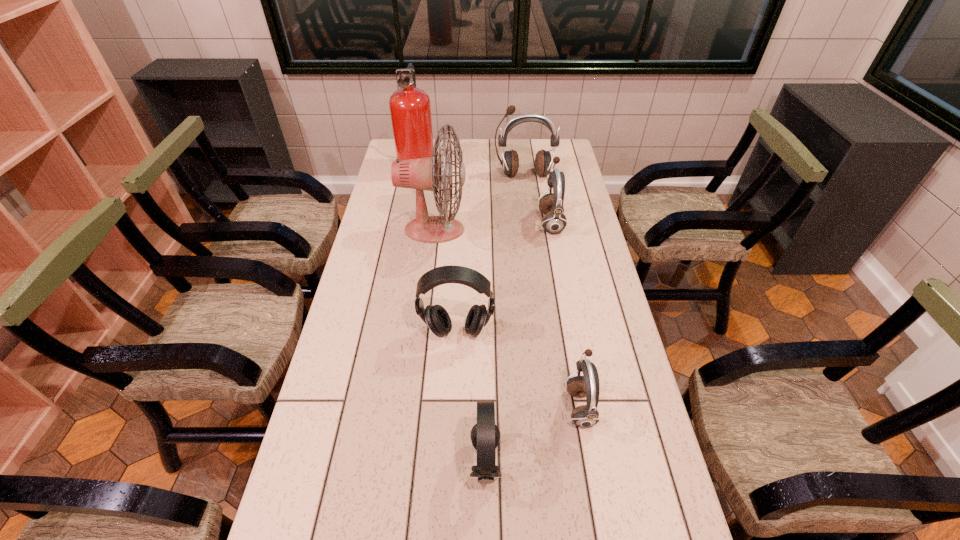
Image resolution: width=960 pixels, height=540 pixels. In order to click on free space located 0.220m with the handle and nozzle on the fire extinguisher in this screenshot , I will do `click(487, 164)`.

At what (x,y) coordinates should I click in order to perform the action: click on free space located 0.220m in front of the fan to direct airflow. Please return your answer as a coordinate pair (x, y). The height and width of the screenshot is (540, 960). Looking at the image, I should click on (528, 230).

Identify the location of vacant space located 0.310m on the ear pads of the tallest earphone. (531, 230).

You are a GUI agent. You are given a task and a screenshot of the screen. Output one action in this format:
    pyautogui.click(x=<x>, y=<y>)
    Task: Click on the vacant space situated on the ear cups of the third farthest earphone
    This screenshot has width=960, height=540.
    Given the screenshot: What is the action you would take?
    pyautogui.click(x=453, y=393)

This screenshot has height=540, width=960. In order to click on free space located on the ear pads of the second nearest brown earphone in this screenshot , I will do click(439, 222).

The image size is (960, 540). In order to click on free space located 0.070m on the ear pads of the second nearest brown earphone in this screenshot , I will do `click(519, 222)`.

At what (x,y) coordinates should I click in order to perform the action: click on vacant area located 0.150m on the ear pads of the second nearest brown earphone. Please return your answer as a coordinate pair (x, y). Image resolution: width=960 pixels, height=540 pixels. Looking at the image, I should click on (498, 222).

This screenshot has height=540, width=960. I want to click on free location located 0.230m on the ear pads of the smallest brown earphone, so coord(474,407).

Identify the location of free point located 0.130m on the ear pads of the smallest brown earphone. The width and height of the screenshot is (960, 540). (515, 407).

Locate an element on the screen. Image resolution: width=960 pixels, height=540 pixels. free spot located on the ear pads of the smallest brown earphone is located at coordinates (470, 407).